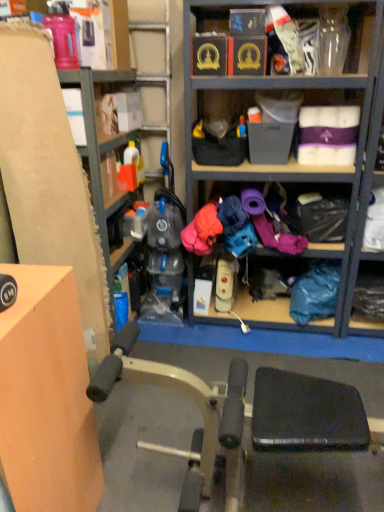
Question: Is blue fabric bag at lower right in front of or behind matte cardboard box at left in the image?

Choices:
 (A) front
 (B) behind

Answer: (B)

Question: In terms of size, does blue fabric bag at lower right appear bigger or smaller than matte cardboard box at left?

Choices:
 (A) small
 (B) big

Answer: (A)

Question: Based on their relative distances, which object is farther from the matte cardboard box at left?

Choices:
 (A) blue fabric bag at lower right
 (B) orange matte table at left

Answer: (A)

Question: Considering the real-world distances, which object is farthest from the orange matte table at left?

Choices:
 (A) matte cardboard box at left
 (B) blue fabric bag at lower right

Answer: (B)